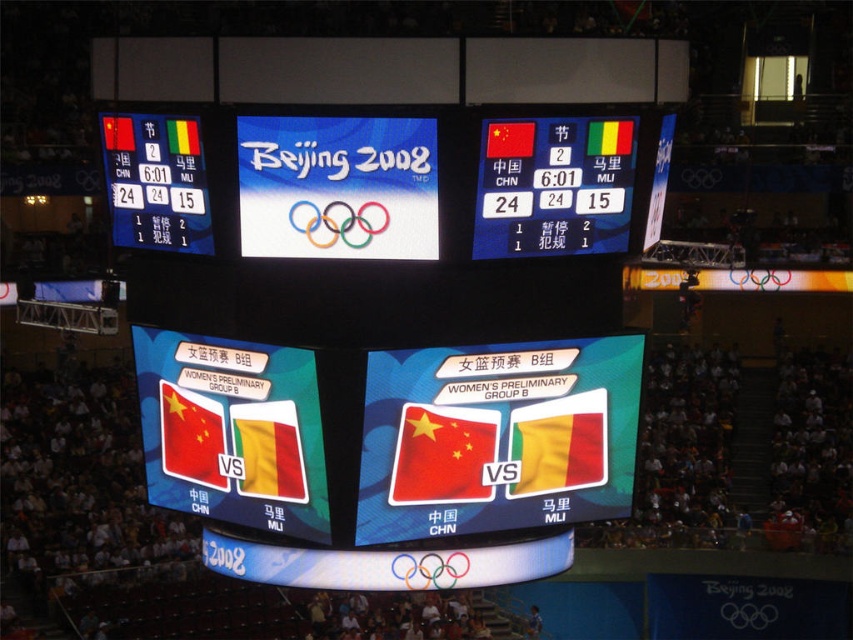
You are a basketball player positioned at the center of the court during a Beijing 2008 Olympic game. You need to pass the ball to a teammate located at point [141,106] and another teammate at point [329,241]. Which teammate is closer to you based on their coordinates?

Point [141,106] is behind point [329,241], so the teammate at point [329,241] is closer to you.

You are a spectator at the Beijing 2008 Olympics basketball game. You notice the white paper at center and the yellow fabric flag at center. Which one is located higher up in the image?

The white paper at center is above the yellow fabric flag at center, so the white paper at center is located higher up in the image.